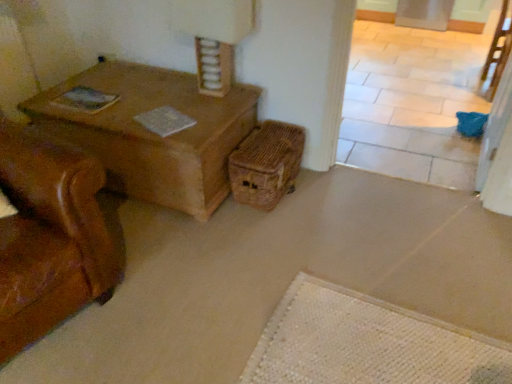
You are a GUI agent. You are given a task and a screenshot of the screen. Output one action in this format:
    pyautogui.click(x=<x>, y=<y>)
    Task: Click on the free spot in front of woven brown basket at lower right
    The image size is (512, 384).
    Given the screenshot: What is the action you would take?
    pyautogui.click(x=271, y=232)